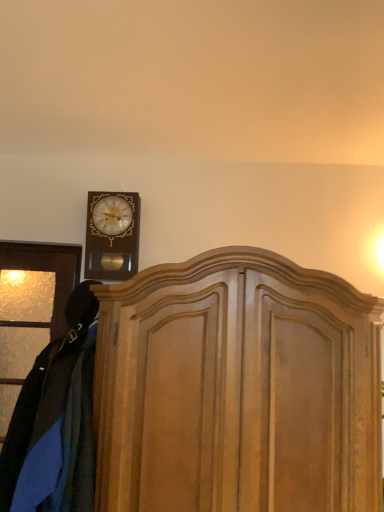
I want to click on velvet blue coat at left, so click(55, 422).

From the image's perspective, is wooden wall clock at upper left above velvet blue coat at left?

Correct, wooden wall clock at upper left appears higher than velvet blue coat at left in the image.

Does wooden wall clock at upper left appear on the right side of velvet blue coat at left?

Yes.

Considering the relative sizes of wooden wall clock at upper left and velvet blue coat at left in the image provided, is wooden wall clock at upper left shorter than velvet blue coat at left?

Yes, wooden wall clock at upper left is shorter than velvet blue coat at left.

From a real-world perspective, which object stands above the other?

wooden wall clock at upper left is physically above.

Locate an element on the screen. The image size is (384, 512). dresser that is on the right side of velvet blue coat at left is located at coordinates 237,388.

Between wooden dresser at center and velvet blue coat at left, which one has more height?

With more height is wooden dresser at center.

Can you tell me how much wooden dresser at center and velvet blue coat at left differ in facing direction?

9.13 degrees.

I want to click on clothing above the wooden dresser at center (from the image's perspective), so click(x=55, y=422).

Is velvet blue coat at left facing away from wooden dresser at center?

That's not correct — velvet blue coat at left is not looking away from wooden dresser at center.

Is velvet blue coat at left taller than wooden dresser at center?

Incorrect, the height of velvet blue coat at left is not larger of that of wooden dresser at center.

From a real-world perspective, is velvet blue coat at left beneath wooden dresser at center?

Indeed, from a real-world perspective, velvet blue coat at left is positioned beneath wooden dresser at center.

Are wooden wall clock at upper left and wooden dresser at center making contact?

wooden wall clock at upper left is not next to wooden dresser at center, and they're not touching.

Considering the sizes of wooden wall clock at upper left and wooden dresser at center in the image, is wooden wall clock at upper left wider or thinner than wooden dresser at center?

wooden wall clock at upper left is thinner than wooden dresser at center.

Find the location of `wall clock that is above the wooden dresser at center (from a real-world perspective)`. wall clock that is above the wooden dresser at center (from a real-world perspective) is located at coordinates (112, 236).

Does wooden dresser at center appear on the right side of wooden wall clock at upper left?

Indeed, wooden dresser at center is positioned on the right side of wooden wall clock at upper left.

Is wooden dresser at center next to wooden wall clock at upper left and touching it?

No, wooden dresser at center is not touching wooden wall clock at upper left.

Relative to wooden wall clock at upper left, is wooden dresser at center in front or behind?

Clearly, wooden dresser at center is in front of wooden wall clock at upper left.

The image size is (384, 512). Find the location of `wall clock above the wooden dresser at center (from the image's perspective)`. wall clock above the wooden dresser at center (from the image's perspective) is located at coordinates 112,236.

How much distance is there between velvet blue coat at left and wooden wall clock at upper left?

velvet blue coat at left is 21.58 inches from wooden wall clock at upper left.

Can you confirm if velvet blue coat at left is wider than wooden wall clock at upper left?

Yes.

Is velvet blue coat at left facing away from wooden wall clock at upper left?

That's not correct — velvet blue coat at left is not looking away from wooden wall clock at upper left.

Can we say velvet blue coat at left lies outside wooden wall clock at upper left?

Indeed, velvet blue coat at left is completely outside wooden wall clock at upper left.

At what (x,y) coordinates should I click in order to perform the action: click on wall clock behind the velvet blue coat at left. Please return your answer as a coordinate pair (x, y). The image size is (384, 512). Looking at the image, I should click on (112, 236).

Where is `clothing that appears in front of the wooden dresser at center`? This screenshot has height=512, width=384. clothing that appears in front of the wooden dresser at center is located at coordinates (55, 422).

From the image, which object appears to be farther from wooden wall clock at upper left, wooden dresser at center or velvet blue coat at left?

Among the two, wooden dresser at center is located further to wooden wall clock at upper left.

When comparing their distances from wooden dresser at center, does wooden wall clock at upper left or velvet blue coat at left seem closer?

Based on the image, velvet blue coat at left appears to be nearer to wooden dresser at center.

Which object lies nearer to the anchor point wooden wall clock at upper left, velvet blue coat at left or wooden dresser at center?

Among the two, velvet blue coat at left is located nearer to wooden wall clock at upper left.

When comparing their distances from velvet blue coat at left, does wooden wall clock at upper left or wooden dresser at center seem further?

wooden wall clock at upper left is further to velvet blue coat at left.

When comparing their distances from velvet blue coat at left, does wooden dresser at center or wooden wall clock at upper left seem further?

wooden wall clock at upper left.

Looking at this image, considering their positions, is velvet blue coat at left positioned further to wooden dresser at center than wooden wall clock at upper left?

wooden wall clock at upper left is further to wooden dresser at center.

Locate an element on the screen. The height and width of the screenshot is (512, 384). dresser positioned between velvet blue coat at left and wooden wall clock at upper left from near to far is located at coordinates (237, 388).